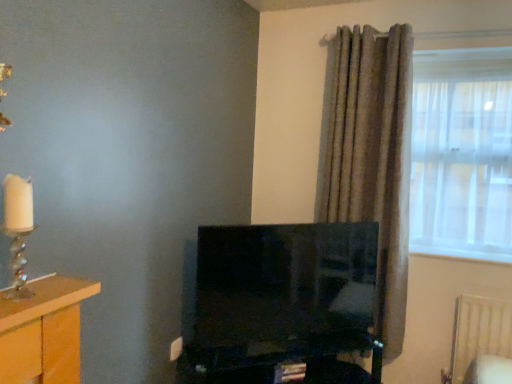
Where is `unoccupied space behind translucent glass candle holder at left`? Image resolution: width=512 pixels, height=384 pixels. unoccupied space behind translucent glass candle holder at left is located at coordinates (38, 281).